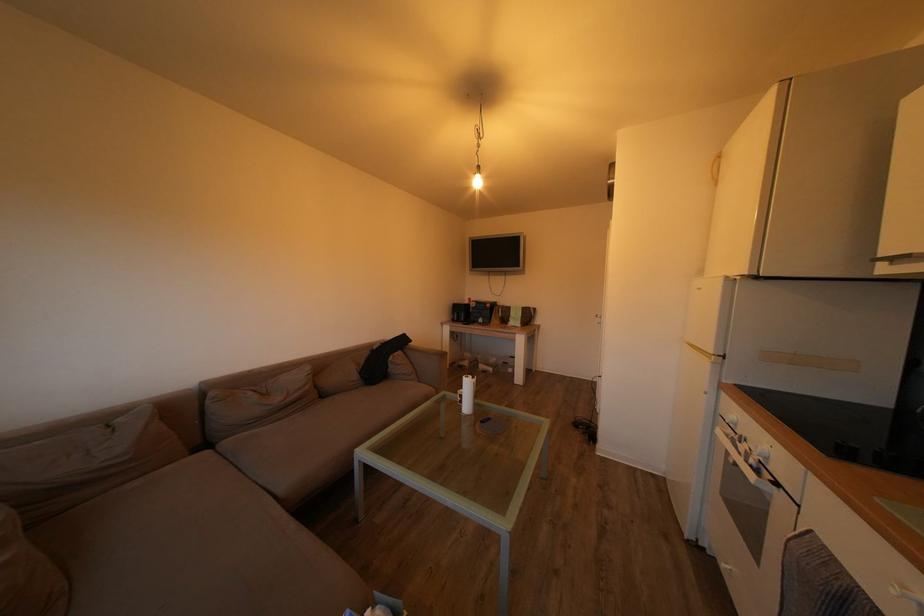
I want to click on brown paper bag, so click(x=516, y=315).